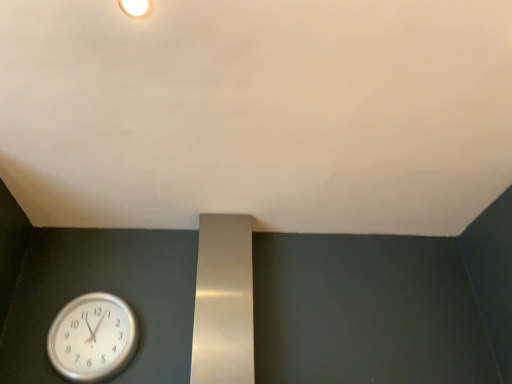
Question: From a real-world perspective, is white matte light fixture at upper center physically located above or below silver metallic clock at lower left?

Choices:
 (A) below
 (B) above

Answer: (B)

Question: From the image's perspective, is white matte light fixture at upper center located above or below silver metallic clock at lower left?

Choices:
 (A) below
 (B) above

Answer: (B)

Question: Which is nearer to the white matte wall at upper center?

Choices:
 (A) white matte light fixture at upper center
 (B) silver metallic clock at lower left

Answer: (A)

Question: Which object is the closest to the silver metallic clock at lower left?

Choices:
 (A) white matte light fixture at upper center
 (B) white matte wall at upper center

Answer: (B)